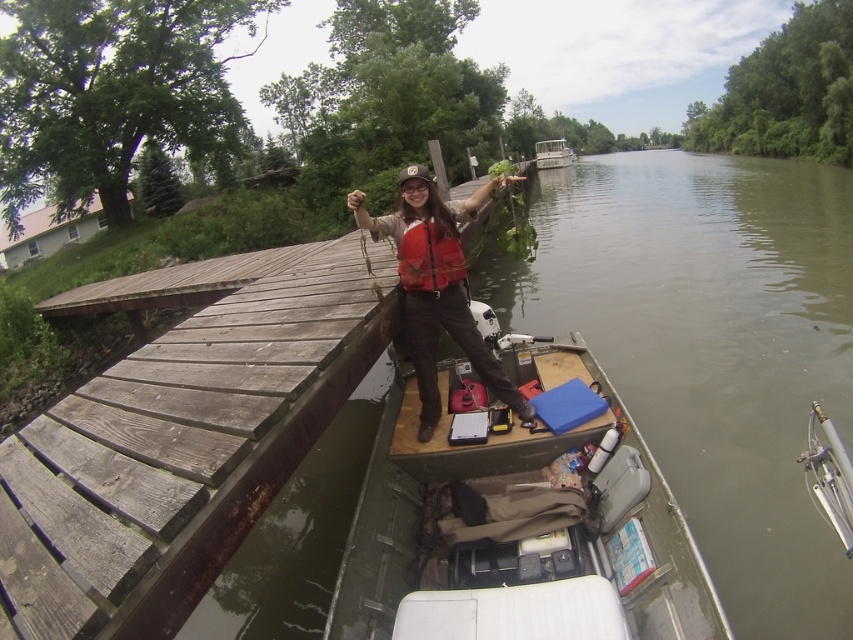
Is wooden table at center to the left of matte orange life vest at center from the viewer's perspective?

No, wooden table at center is not to the left of matte orange life vest at center.

Is point (403, 532) positioned after point (480, 196)?

No.

Locate an element on the screen. This screenshot has width=853, height=640. wooden table at center is located at coordinates (520, 536).

Can you confirm if weathered wood dock at upper left is positioned to the right of matte orange life vest at center?

Incorrect, weathered wood dock at upper left is not on the right side of matte orange life vest at center.

Is point (167, 513) in front of point (399, 227)?

Yes, point (167, 513) is in front of point (399, 227).

In order to click on weathered wood dock at upper left in this screenshot , I will do `click(178, 449)`.

Who is more forward, (267, 380) or (555, 161)?

Point (267, 380)

Who is positioned more to the left, weathered wood dock at upper left or green plastic boat at upper center?

weathered wood dock at upper left

You are a GUI agent. You are given a task and a screenshot of the screen. Output one action in this format:
    pyautogui.click(x=<x>, y=<y>)
    Task: Click on the weathered wood dock at upper left
    
    Given the screenshot: What is the action you would take?
    pyautogui.click(x=178, y=449)